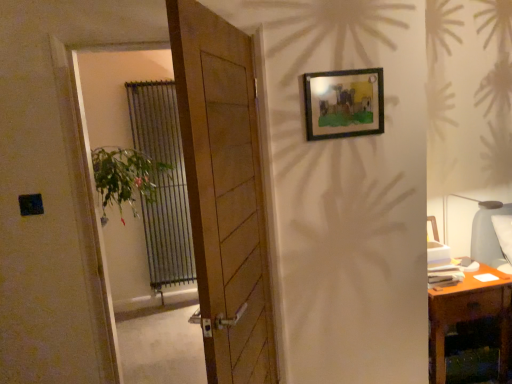
Question: From a real-world perspective, is metallic silver radiator at left positioned under wooden desk at right based on gravity?

Choices:
 (A) no
 (B) yes

Answer: (A)

Question: Does metallic silver radiator at left appear on the left side of wooden desk at right?

Choices:
 (A) no
 (B) yes

Answer: (B)

Question: Considering the relative sizes of metallic silver radiator at left and wooden desk at right in the image provided, is metallic silver radiator at left bigger than wooden desk at right?

Choices:
 (A) no
 (B) yes

Answer: (A)

Question: Are metallic silver radiator at left and wooden desk at right located far from each other?

Choices:
 (A) no
 (B) yes

Answer: (B)

Question: Is metallic silver radiator at left not inside wooden desk at right?

Choices:
 (A) yes
 (B) no

Answer: (A)

Question: From a real-world perspective, is metallic silver radiator at left positioned above or below wooden desk at right?

Choices:
 (A) above
 (B) below

Answer: (A)

Question: From their relative heights in the image, would you say metallic silver radiator at left is taller or shorter than wooden desk at right?

Choices:
 (A) tall
 (B) short

Answer: (A)

Question: Is metallic silver radiator at left situated inside wooden desk at right or outside?

Choices:
 (A) inside
 (B) outside

Answer: (B)

Question: From the image's perspective, is metallic silver radiator at left above or below wooden desk at right?

Choices:
 (A) below
 (B) above

Answer: (B)

Question: Considering the positions of wooden frame at upper right and metallic silver radiator at left in the image, is wooden frame at upper right bigger or smaller than metallic silver radiator at left?

Choices:
 (A) small
 (B) big

Answer: (A)

Question: Considering the positions of wooden frame at upper right and metallic silver radiator at left in the image, is wooden frame at upper right taller or shorter than metallic silver radiator at left?

Choices:
 (A) tall
 (B) short

Answer: (B)

Question: Is point (373, 112) positioned closer to the camera than point (154, 258)?

Choices:
 (A) closer
 (B) farther

Answer: (A)

Question: Is wooden frame at upper right wider or thinner than metallic silver radiator at left?

Choices:
 (A) thin
 (B) wide

Answer: (A)

Question: Is wooden frame at upper right in front of or behind wooden door at center in the image?

Choices:
 (A) front
 (B) behind

Answer: (B)

Question: Do you think wooden frame at upper right is within wooden door at center, or outside of it?

Choices:
 (A) outside
 (B) inside

Answer: (A)